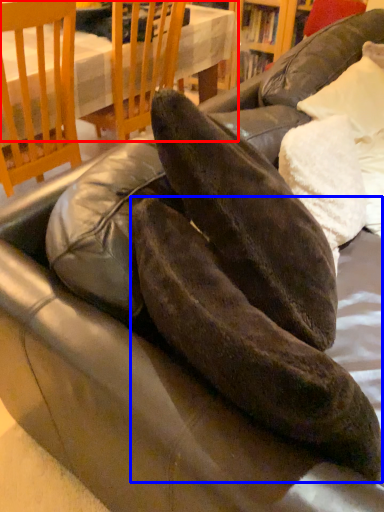
Question: Which object is closer to the camera taking this photo, table (highlighted by a red box) or leather shoe (highlighted by a blue box)?

Choices:
 (A) table
 (B) leather shoe

Answer: (B)